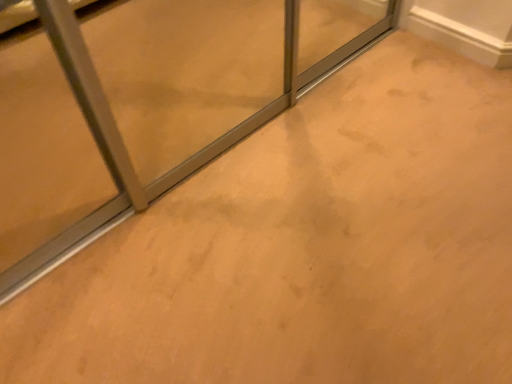
Describe the element at coordinates (150, 105) in the screenshot. The width and height of the screenshot is (512, 384). I see `matte glass door at upper left` at that location.

This screenshot has height=384, width=512. I want to click on matte glass door at upper left, so click(150, 105).

Locate an element on the screen. Image resolution: width=512 pixels, height=384 pixels. matte glass door at upper left is located at coordinates 150,105.